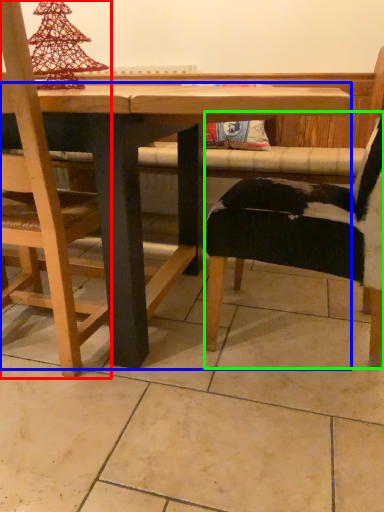
Question: Based on their relative distances, which object is nearer to chair (highlighted by a red box)? Choose from table (highlighted by a blue box) and chair (highlighted by a green box).

Choices:
 (A) table
 (B) chair

Answer: (A)